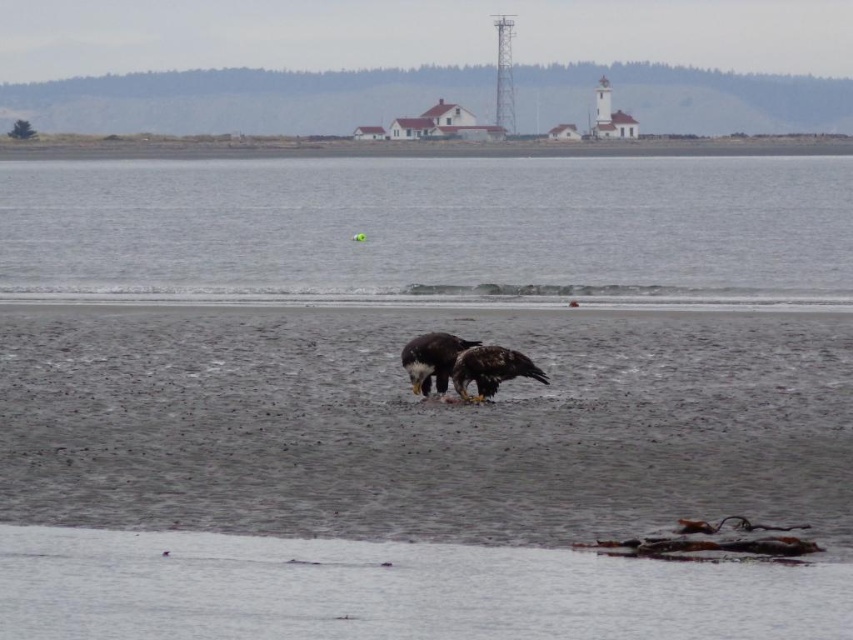
Question: Is brown feathered eagle at center bigger than white feathers eagle at center?

Choices:
 (A) no
 (B) yes

Answer: (B)

Question: Is gray matte water at center below brown feathered eagle at center?

Choices:
 (A) yes
 (B) no

Answer: (B)

Question: Based on their relative distances, which object is nearer to the white feathers eagle at center?

Choices:
 (A) brown feathered eagle at center
 (B) gray matte water at center

Answer: (A)

Question: Can you confirm if gray matte water at center is thinner than white feathers eagle at center?

Choices:
 (A) no
 (B) yes

Answer: (A)

Question: Which of these objects is positioned farthest from the white feathers eagle at center?

Choices:
 (A) brown feathered eagle at center
 (B) gray matte water at center

Answer: (B)

Question: Which of these objects is positioned closest to the white feathers eagle at center?

Choices:
 (A) brown feathered eagle at center
 (B) gray matte water at center

Answer: (A)